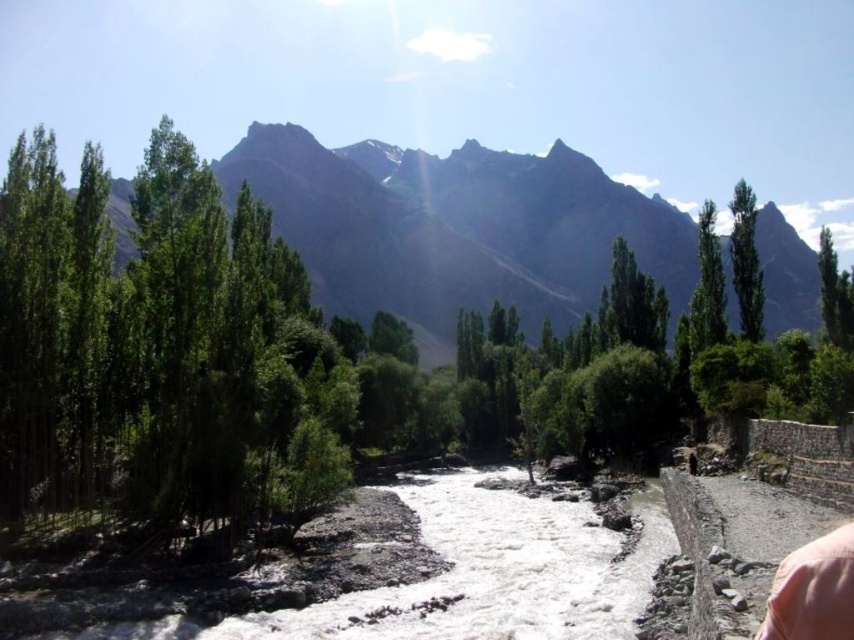
Between white rocky creek at center and green leafy tree at upper right, which one has less height?

white rocky creek at center

Does white rocky creek at center appear over green leafy tree at upper right?

Incorrect, white rocky creek at center is not positioned above green leafy tree at upper right.

Locate an element on the screen. The image size is (854, 640). white rocky creek at center is located at coordinates (472, 573).

Between green leafy trees at upper center and white rocky creek at center, which one appears on the right side from the viewer's perspective?

From the viewer's perspective, green leafy trees at upper center appears more on the right side.

Does point (449, 276) come in front of point (303, 632)?

No, it is not.

Locate an element on the screen. green leafy trees at upper center is located at coordinates pos(455,228).

Consider the image. Between pink fabric at lower right and green leafy tree at upper right, which one appears on the left side from the viewer's perspective?

From the viewer's perspective, pink fabric at lower right appears more on the left side.

From the picture: Between pink fabric at lower right and green leafy tree at upper right, which one has more height?

With more height is green leafy tree at upper right.

Based on the photo, who is more distant from viewer, [774,589] or [736,200]?

The point [736,200] is more distant.

At what (x,y) coordinates should I click in order to perform the action: click on pink fabric at lower right. Please return your answer as a coordinate pair (x, y). Looking at the image, I should click on (812, 589).